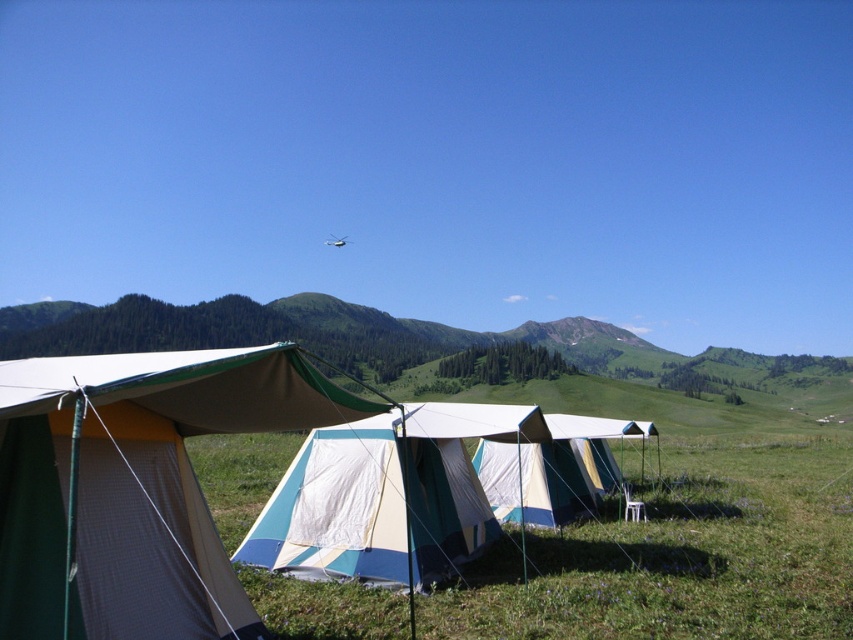
Describe the element at coordinates (135, 486) in the screenshot. I see `matte canvas tent at left` at that location.

Is matte canvas tent at left wider than white canvas tent at center?

Indeed, matte canvas tent at left has a greater width compared to white canvas tent at center.

Which is in front, point (137, 506) or point (434, 481)?

Positioned in front is point (137, 506).

I want to click on matte canvas tent at left, so click(x=135, y=486).